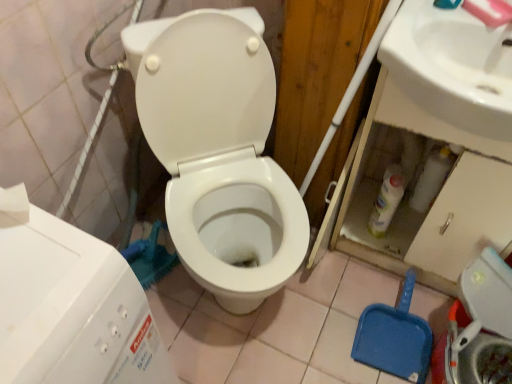
Measure the distance between white glossy toilet at center and camera.

white glossy toilet at center and camera are 38.53 inches apart.

This screenshot has height=384, width=512. Find the location of `white glossy toilet at center`. white glossy toilet at center is located at coordinates (218, 151).

Image resolution: width=512 pixels, height=384 pixels. Describe the element at coordinates (70, 305) in the screenshot. I see `white plastic water tank at lower left` at that location.

Locate an element on the screen. Image resolution: width=512 pixels, height=384 pixels. white plastic washer at lower right is located at coordinates (482, 324).

The height and width of the screenshot is (384, 512). Find the location of `toilet behind the white plastic water tank at lower left`. toilet behind the white plastic water tank at lower left is located at coordinates (218, 151).

Can you see white plastic water tank at lower left touching white glossy toilet at center?

No, white plastic water tank at lower left is not making contact with white glossy toilet at center.

Measure the distance between white plastic water tank at lower left and white glossy toilet at center.

white plastic water tank at lower left is 19.32 inches from white glossy toilet at center.

Considering the sizes of white glossy sink at upper right and white plastic washer at lower right in the image, is white glossy sink at upper right bigger or smaller than white plastic washer at lower right?

In the image, white glossy sink at upper right appears to be smaller than white plastic washer at lower right.

Which object is closer to the camera taking this photo, white glossy sink at upper right or white plastic washer at lower right?

white glossy sink at upper right is closer to the camera.

How many degrees apart are the facing directions of white glossy sink at upper right and white plastic washer at lower right?

There is a 86.1-degree angle between the facing directions of white glossy sink at upper right and white plastic washer at lower right.

Considering the relative sizes of white glossy toilet at center and white plastic water tank at lower left in the image provided, is white glossy toilet at center taller than white plastic water tank at lower left?

Correct, white glossy toilet at center is much taller as white plastic water tank at lower left.

Is point (137, 32) closer or farther from the camera than point (13, 377)?

Point (137, 32) appears to be farther away from the viewer than point (13, 377).

Based on their positions, is white glossy toilet at center located to the left or right of white plastic water tank at lower left?

From the image, it's evident that white glossy toilet at center is to the right of white plastic water tank at lower left.

Considering the relative sizes of white glossy toilet at center and white plastic water tank at lower left in the image provided, is white glossy toilet at center thinner than white plastic water tank at lower left?

Incorrect, the width of white glossy toilet at center is not less than that of white plastic water tank at lower left.

Would you say white plastic washer at lower right is inside or outside white glossy toilet at center?

The correct answer is: outside.

Does white plastic washer at lower right appear on the left side of white glossy toilet at center?

Incorrect, white plastic washer at lower right is not on the left side of white glossy toilet at center.

At what (x,y) coordinates should I click in order to perform the action: click on washer behind the white glossy toilet at center. Please return your answer as a coordinate pair (x, y). The image size is (512, 384). Looking at the image, I should click on [482, 324].

Is white plastic washer at lower right oriented away from white glossy toilet at center?

No.

Would you consider white plastic washer at lower right to be distant from white plastic water tank at lower left?

white plastic washer at lower right is near white plastic water tank at lower left, not far away.

What's the angular difference between white plastic washer at lower right and white plastic water tank at lower left's facing directions?

white plastic washer at lower right and white plastic water tank at lower left are facing 177 degrees away from each other.

In terms of height, does white plastic washer at lower right look taller or shorter compared to white plastic water tank at lower left?

white plastic washer at lower right is shorter than white plastic water tank at lower left.

Is white glossy toilet at center to the left or to the right of white glossy sink at upper right in the image?

white glossy toilet at center is positioned on white glossy sink at upper right's left side.

Which is in front, point (229, 15) or point (460, 98)?

Point (460, 98)

In the scene shown: Which is correct: white glossy toilet at center is inside white glossy sink at upper right, or outside of it?

white glossy toilet at center is spatially situated outside white glossy sink at upper right.

Who is taller, white glossy toilet at center or white glossy sink at upper right?

white glossy toilet at center is taller.

Can you confirm if white glossy sink at upper right is wider than white plastic water tank at lower left?

No.

From a real-world perspective, does white glossy sink at upper right sit lower than white plastic water tank at lower left?

Incorrect, from a real-world perspective, white glossy sink at upper right is higher than white plastic water tank at lower left.

This screenshot has height=384, width=512. I want to click on sink on the right side of white plastic water tank at lower left, so (x=452, y=67).

I want to click on water tank lying on the left of white glossy toilet at center, so click(x=70, y=305).

What are the coordinates of `washer behind the white glossy sink at upper right` in the screenshot? It's located at (482, 324).

Estimate the real-world distances between objects in this image. Which object is closer to white glossy sink at upper right, white glossy toilet at center or white plastic water tank at lower left?

white glossy toilet at center is closer to white glossy sink at upper right.

From the image, which object appears to be farther from white glossy toilet at center, white plastic water tank at lower left or white plastic washer at lower right?

white plastic washer at lower right lies further to white glossy toilet at center than the other object.

Considering their positions, is white plastic water tank at lower left positioned further to white plastic washer at lower right than white glossy toilet at center?

The object further to white plastic washer at lower right is white plastic water tank at lower left.

Considering their positions, is white plastic water tank at lower left positioned closer to white plastic washer at lower right than white glossy sink at upper right?

Among the two, white glossy sink at upper right is located nearer to white plastic washer at lower right.

Based on their spatial positions, is white plastic washer at lower right or white plastic water tank at lower left further from white glossy toilet at center?

Among the two, white plastic washer at lower right is located further to white glossy toilet at center.

Looking at the image, which one is located further to white plastic water tank at lower left, white plastic washer at lower right or white glossy toilet at center?

Based on the image, white plastic washer at lower right appears to be further to white plastic water tank at lower left.

Considering their positions, is white glossy toilet at center positioned closer to white plastic washer at lower right than white plastic water tank at lower left?

Based on the image, white glossy toilet at center appears to be nearer to white plastic washer at lower right.

From the image, which object appears to be nearer to white glossy toilet at center, white plastic washer at lower right or white glossy sink at upper right?

Among the two, white glossy sink at upper right is located nearer to white glossy toilet at center.

Image resolution: width=512 pixels, height=384 pixels. What are the coordinates of `toilet between white plastic water tank at lower left and white glossy sink at upper right from left to right` in the screenshot? It's located at (218, 151).

Locate an element on the screen. toilet between white plastic water tank at lower left and white plastic washer at lower right in the horizontal direction is located at coordinates (218, 151).

You are a GUI agent. You are given a task and a screenshot of the screen. Output one action in this format:
    pyautogui.click(x=<x>, y=<y>)
    Task: Click on the sink located between white glossy toilet at center and white plastic washer at lower right in the left-right direction
    The image size is (512, 384).
    Given the screenshot: What is the action you would take?
    pyautogui.click(x=452, y=67)

Locate an element on the screen. This screenshot has height=384, width=512. sink located between white plastic water tank at lower left and white plastic washer at lower right in the left-right direction is located at coordinates (452, 67).